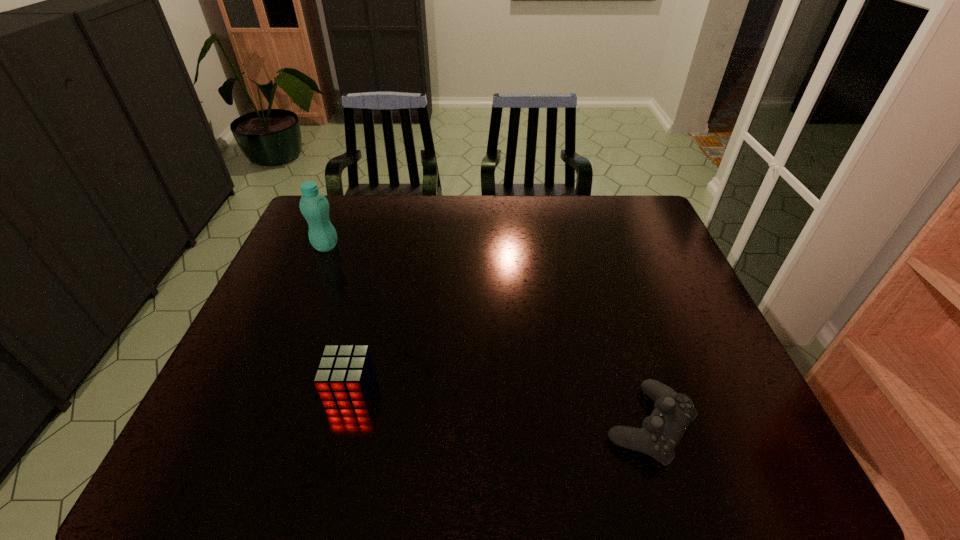
At what (x,y) coordinates should I click in order to perform the action: click on vacant area that lies between the farthest object and the rightmost object. Please return your answer as a coordinate pair (x, y). Looking at the image, I should click on tap(488, 335).

Where is `free point between the shortest object and the bottle`? The width and height of the screenshot is (960, 540). free point between the shortest object and the bottle is located at coordinates (488, 335).

This screenshot has width=960, height=540. Find the location of `vacant point located between the tallest object and the second tallest object`. vacant point located between the tallest object and the second tallest object is located at coordinates (338, 318).

This screenshot has width=960, height=540. Identify the location of free space between the control and the bottle. (488, 335).

Find the location of a particular element. The height and width of the screenshot is (540, 960). unoccupied area between the second object from left to right and the tallest object is located at coordinates (338, 318).

Where is `vacant area that lies between the tallest object and the second shortest object`? The height and width of the screenshot is (540, 960). vacant area that lies between the tallest object and the second shortest object is located at coordinates (338, 318).

The image size is (960, 540). I want to click on free point between the leftmost object and the shortest object, so click(488, 335).

At what (x,y) coordinates should I click in order to perform the action: click on free space between the second shortest object and the rightmost object. Please return your answer as a coordinate pair (x, y). The height and width of the screenshot is (540, 960). Looking at the image, I should click on (500, 407).

I want to click on the second closest object relative to the cube, so click(x=661, y=432).

Select which object is the closest to the control. Please provide its 2D coordinates. Your answer should be formatted as a tuple, i.e. [(x, y)], where the tuple contains the x and y coordinates of a point satisfying the conditions above.

[(345, 375)]